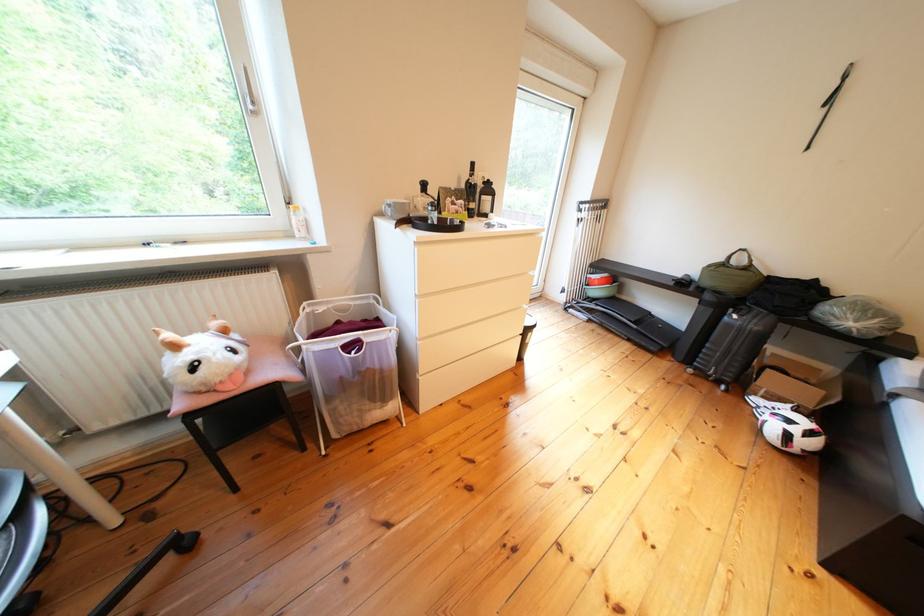
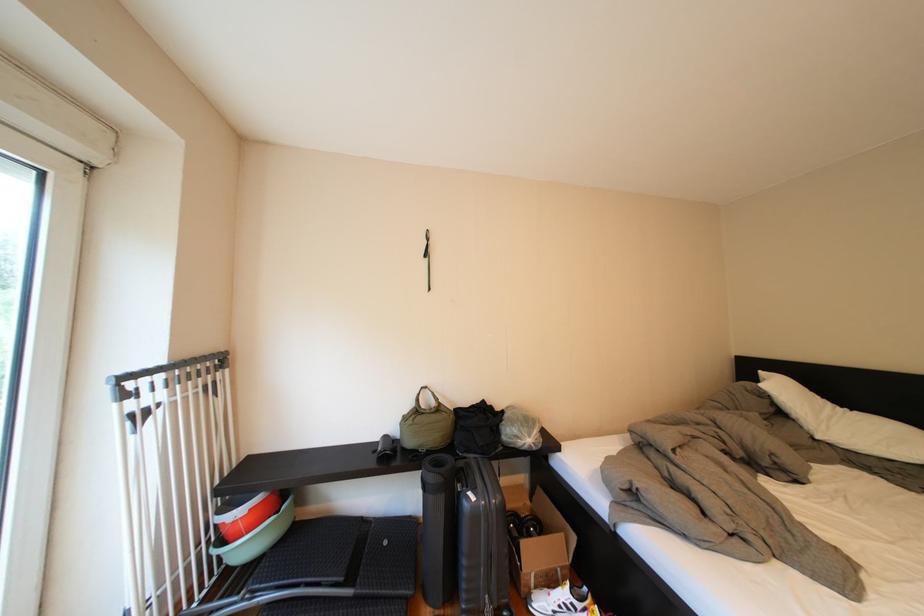
Where in the second image is the point corresponding to point (748, 322) from the first image?

(487, 503)